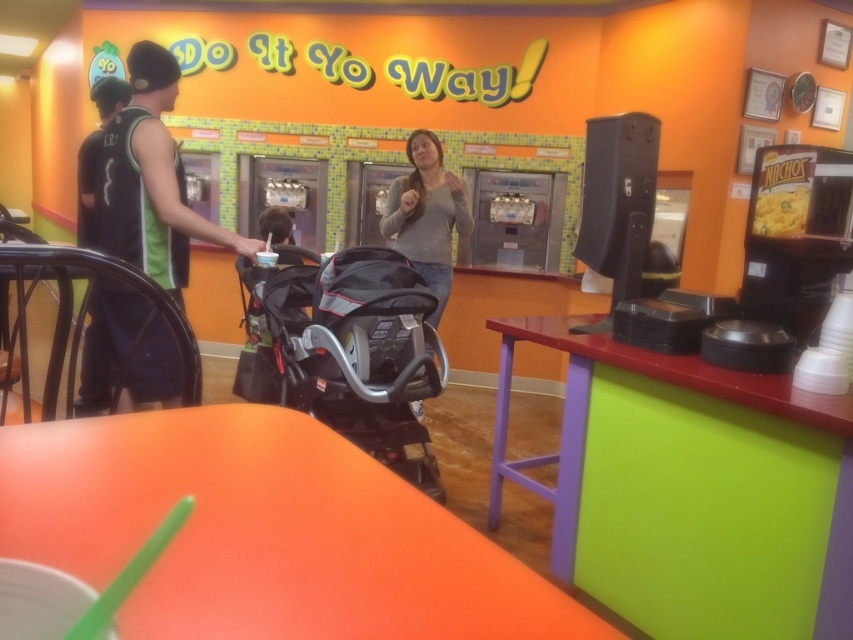
Is black textured stroller at center shorter than yellow matte nachos at upper right?

No.

Does point (294, 333) lie behind point (763, 212)?

Yes, it is behind point (763, 212).

This screenshot has height=640, width=853. Find the location of `black textured stroller at center`. black textured stroller at center is located at coordinates (345, 349).

Between point (152, 337) and point (397, 211), which one is positioned in front?

Point (152, 337)

Does black sleeveless shirt at left come behind gray matte sweater at center?

No, black sleeveless shirt at left is closer to the viewer.

Identify the location of black sleeveless shirt at left. The width and height of the screenshot is (853, 640). (151, 180).

Is black textured stroller at center positioned behind gray matte sweater at center?

No.

Does black textured stroller at center have a larger size compared to gray matte sweater at center?

Indeed, black textured stroller at center has a larger size compared to gray matte sweater at center.

Which is behind, point (393, 413) or point (437, 212)?

The point (437, 212) is more distant.

This screenshot has height=640, width=853. Find the location of `black textured stroller at center`. black textured stroller at center is located at coordinates (345, 349).